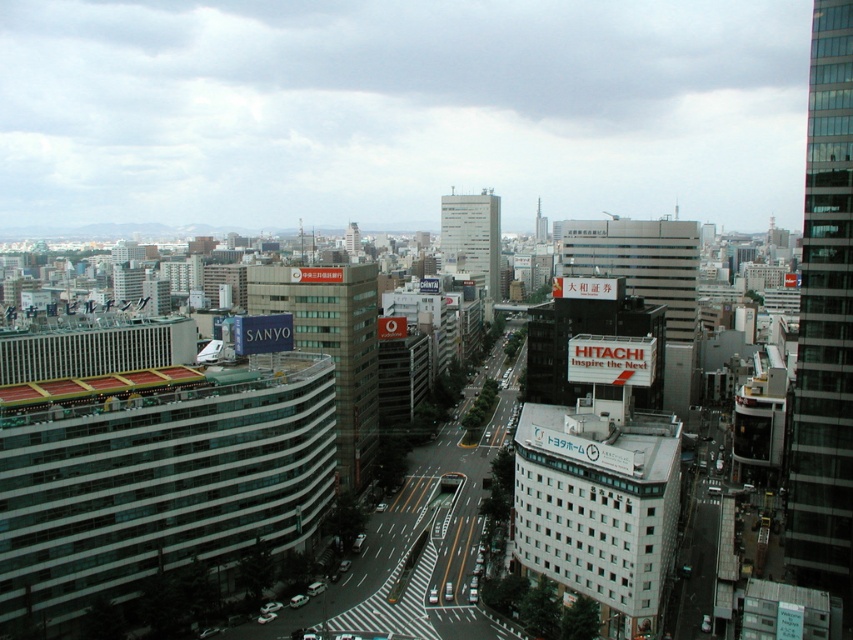
Question: Which point is closer to the camera?

Choices:
 (A) green glass building at center
 (B) transparent glass skyscraper at right

Answer: (B)

Question: Is transparent glass skyscraper at right positioned behind green glass building at center?

Choices:
 (A) no
 (B) yes

Answer: (A)

Question: Estimate the real-world distances between objects in this image. Which object is closer to the white glass building at center?

Choices:
 (A) green glass building at center
 (B) transparent glass skyscraper at right

Answer: (A)

Question: Is transparent glass skyscraper at right to the left of white glass building at center from the viewer's perspective?

Choices:
 (A) yes
 (B) no

Answer: (B)

Question: Can you confirm if transparent glass skyscraper at right is wider than white glass building at center?

Choices:
 (A) yes
 (B) no

Answer: (B)

Question: Which object is positioned closest to the green glass building at center?

Choices:
 (A) transparent glass skyscraper at right
 (B) white glass building at center

Answer: (A)